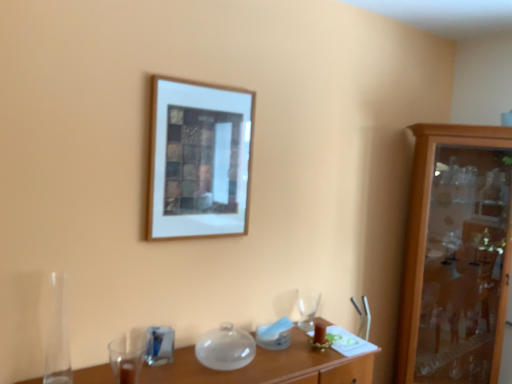
Question: In terms of width, does transparent glass vase at lower left look wider or thinner when compared to wooden cabinet at right?

Choices:
 (A) wide
 (B) thin

Answer: (B)

Question: Would you say transparent glass vase at lower left is to the left or to the right of wooden cabinet at right in the picture?

Choices:
 (A) left
 (B) right

Answer: (A)

Question: Based on their relative distances, which object is nearer to the wooden picture frame at upper center?

Choices:
 (A) transparent glass vase at lower left
 (B) clear glass wine glass at center, marked as the 1th tableware in a right-to-left arrangement
 (C) wooden cabinet at right
 (D) blue glass at lower left, the 2th tableware in the back-to-front sequence
 (E) translucent glass table at lower center

Answer: (A)

Question: Based on their relative distances, which object is farther from the translucent glass table at lower center?

Choices:
 (A) wooden picture frame at upper center
 (B) blue glass at lower left, the 2th tableware positioned from the right
 (C) transparent glass vase at lower left
 (D) wooden cabinet at right
 (E) clear glass wine glass at center, the first tableware from the back

Answer: (D)